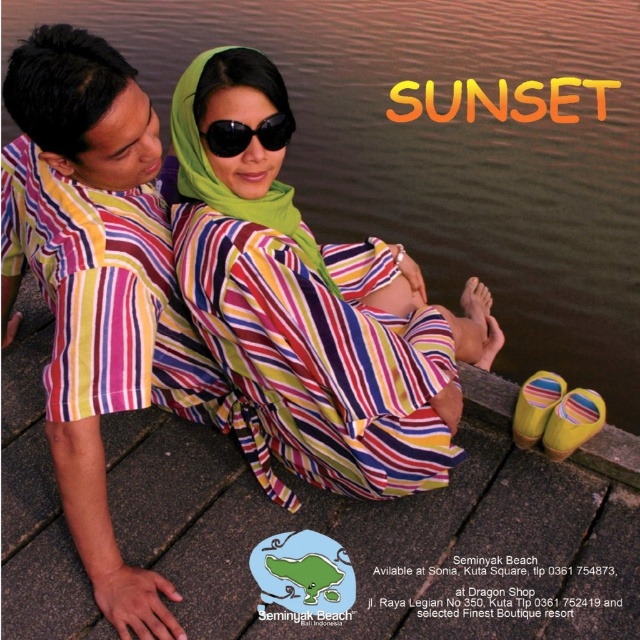
Which is more to the left, smooth brown water at center or black matte sunglasses at center?

Positioned to the left is black matte sunglasses at center.

Is smooth brown water at center bigger than black matte sunglasses at center?

Indeed, smooth brown water at center has a larger size compared to black matte sunglasses at center.

Does point (632, 40) come in front of point (273, 147)?

No, it is not.

At what (x,y) coordinates should I click in order to perform the action: click on smooth brown water at center. Please return your answer as a coordinate pair (x, y). The height and width of the screenshot is (640, 640). Looking at the image, I should click on (445, 147).

Is smooth brown water at center wider than striped cotton shirt at left?

Indeed, smooth brown water at center has a greater width compared to striped cotton shirt at left.

Does smooth brown water at center have a lesser width compared to striped cotton shirt at left?

No.

At what (x,y) coordinates should I click in order to perform the action: click on smooth brown water at center. Please return your answer as a coordinate pair (x, y). The image size is (640, 640). Looking at the image, I should click on (445, 147).

Can you confirm if matte striped baby at center is shorter than black matte sunglasses at center?

Incorrect, matte striped baby at center's height does not fall short of black matte sunglasses at center's.

Does matte striped baby at center have a lesser width compared to black matte sunglasses at center?

Incorrect, matte striped baby at center's width is not less than black matte sunglasses at center's.

Between point (412, 300) and point (282, 134), which one is positioned in front?

Positioned in front is point (282, 134).

Identify the location of matte striped baby at center. This screenshot has height=640, width=640. (378, 276).